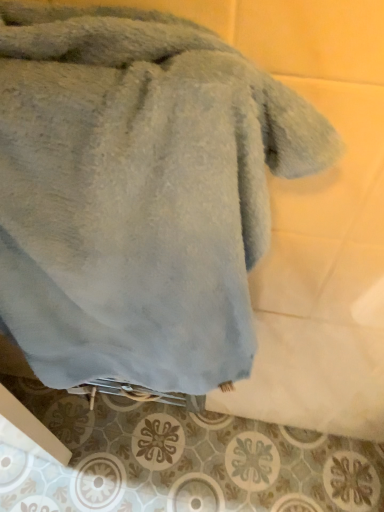
Describe the element at coordinates (138, 193) in the screenshot. I see `light blue plush towel at center` at that location.

The height and width of the screenshot is (512, 384). In order to click on light blue plush towel at center in this screenshot , I will do `click(138, 193)`.

Where is `light blue plush towel at center`? light blue plush towel at center is located at coordinates (138, 193).